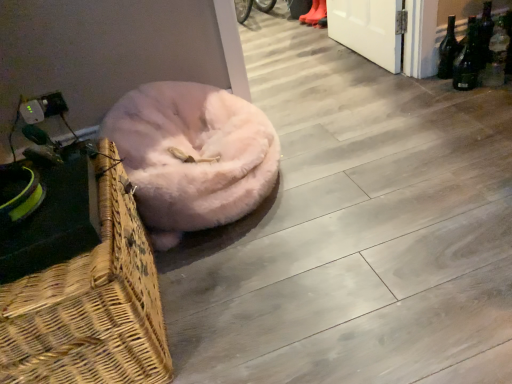
Question: Considering the positions of green glass bottle at right, acting as the third bottle starting from the left, and dark green glass bottle at upper right, which appears as the 2th bottle when viewed from the left, in the image, is green glass bottle at right, acting as the third bottle starting from the left, wider or thinner than dark green glass bottle at upper right, which appears as the 2th bottle when viewed from the left,?

Choices:
 (A) wide
 (B) thin

Answer: (A)

Question: Is green glass bottle at right, positioned as the 1th bottle in right-to-left order, taller or shorter than dark green glass bottle at upper right, the 2th bottle from the right?

Choices:
 (A) short
 (B) tall

Answer: (A)

Question: Which object is positioned farthest from the fuzzy pink dog bed at lower left?

Choices:
 (A) orange rubber boots at upper center
 (B) dark green glass bottle at upper right, marked as the 3th bottle in a right-to-left arrangement
 (C) woven wood picnic basket at lower left
 (D) dark green glass bottle at upper right, the 2th bottle from the right
 (E) green glass bottle at right, positioned as the 1th bottle in right-to-left order

Answer: (A)

Question: Which object is positioned farthest from the dark green glass bottle at upper right, the 1th bottle from the left?

Choices:
 (A) fuzzy pink dog bed at lower left
 (B) woven wood picnic basket at lower left
 (C) dark green glass bottle at upper right, the 2th bottle from the right
 (D) orange rubber boots at upper center
 (E) green glass bottle at right, positioned as the 1th bottle in right-to-left order

Answer: (B)